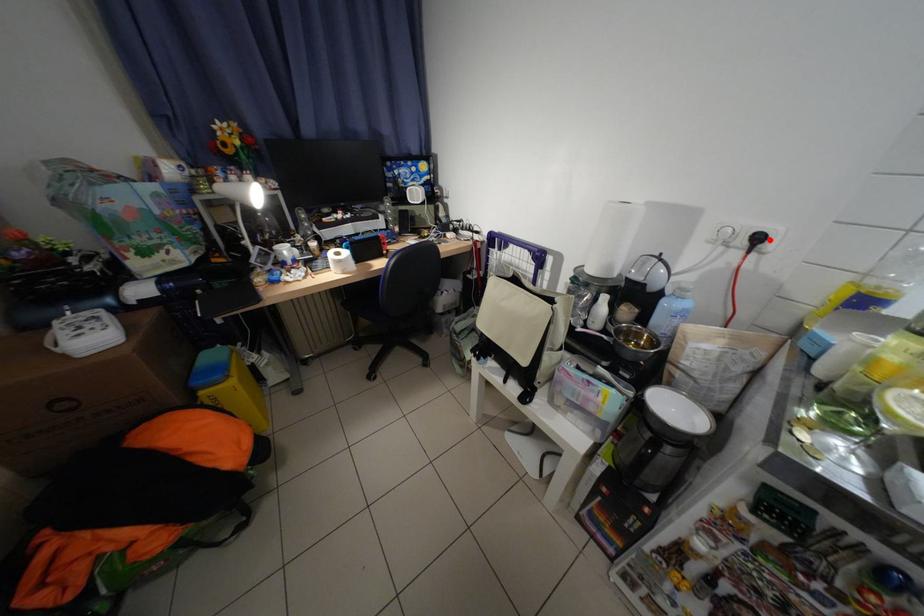
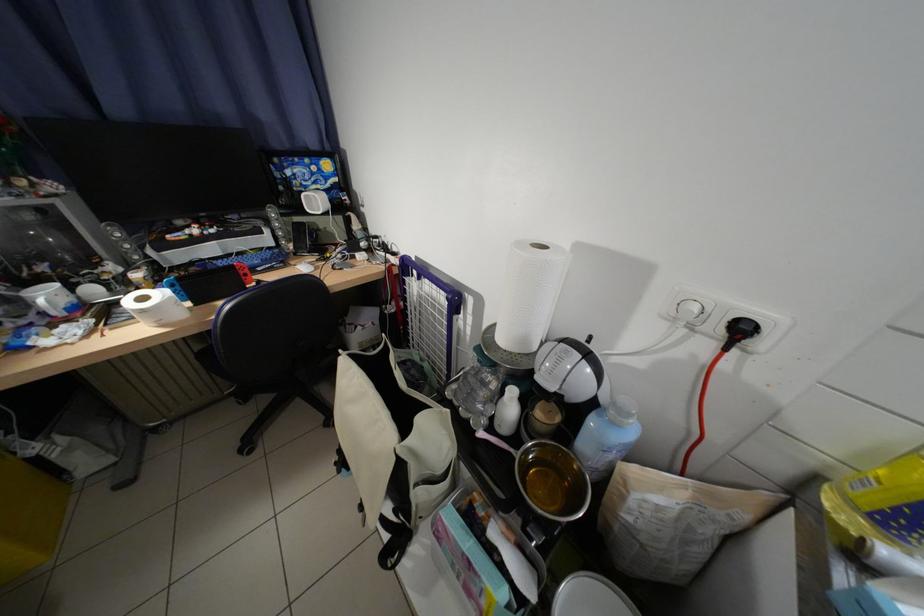
Find the pixel in the second image that matches the highlighted location in the first image.

(754, 331)